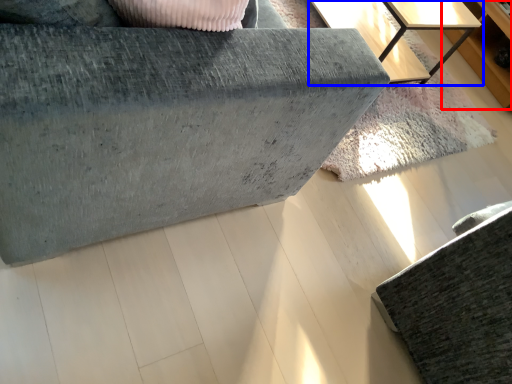
Question: Which of the following is the closest to the observer, dresser (highlighted by a red box) or table (highlighted by a blue box)?

Choices:
 (A) dresser
 (B) table

Answer: (B)